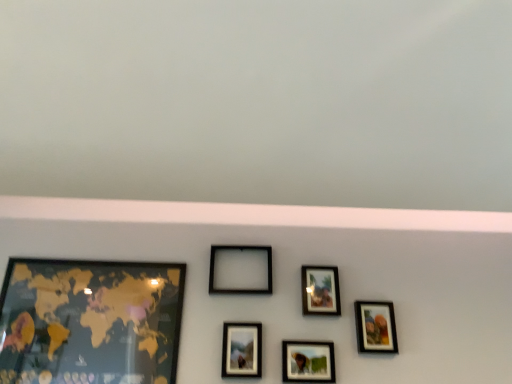
Question: Is gold matte map at left, arranged as the 1th picture frame when viewed from the left, positioned in front of matte black picture frame at upper center, the fifth picture frame viewed from the left?

Choices:
 (A) no
 (B) yes

Answer: (B)

Question: From the image's perspective, would you say gold matte map at left, arranged as the 1th picture frame when viewed from the left, is positioned over matte black picture frame at upper center, the fifth picture frame viewed from the left?

Choices:
 (A) yes
 (B) no

Answer: (B)

Question: Are gold matte map at left, arranged as the 1th picture frame when viewed from the left, and matte black picture frame at upper center, the fifth picture frame viewed from the left, located far from each other?

Choices:
 (A) no
 (B) yes

Answer: (A)

Question: Can you confirm if gold matte map at left, arranged as the 1th picture frame when viewed from the left, is thinner than matte black picture frame at upper center, the 2th picture frame from the right?

Choices:
 (A) no
 (B) yes

Answer: (A)

Question: Does gold matte map at left, which appears as the sixth picture frame when viewed from the right, lie behind matte black picture frame at upper center, the fifth picture frame viewed from the left?

Choices:
 (A) no
 (B) yes

Answer: (A)

Question: Is gold matte map at left, arranged as the 1th picture frame when viewed from the left, smaller than matte black picture frame at upper center, the 2th picture frame from the right?

Choices:
 (A) yes
 (B) no

Answer: (B)

Question: Can matte black picture frame at upper center, the 2th picture frame from the right, be found inside matte black picture frame at center, which appears as the third picture frame when viewed from the right?

Choices:
 (A) yes
 (B) no

Answer: (B)

Question: Is matte black picture frame at center, placed as the fourth picture frame when sorted from left to right, positioned with its back to matte black picture frame at upper center, the fifth picture frame viewed from the left?

Choices:
 (A) yes
 (B) no

Answer: (B)

Question: Is matte black picture frame at center, placed as the fourth picture frame when sorted from left to right, thinner than matte black picture frame at upper center, the fifth picture frame viewed from the left?

Choices:
 (A) yes
 (B) no

Answer: (B)

Question: Is matte black picture frame at center, which appears as the third picture frame when viewed from the right, next to matte black picture frame at upper center, the fifth picture frame viewed from the left?

Choices:
 (A) no
 (B) yes

Answer: (A)

Question: From a real-world perspective, is matte black picture frame at center, which appears as the third picture frame when viewed from the right, physically below matte black picture frame at upper center, the fifth picture frame viewed from the left?

Choices:
 (A) no
 (B) yes

Answer: (B)

Question: Is matte black picture frame at center, which appears as the third picture frame when viewed from the right, to the right of matte black picture frame at upper center, the fifth picture frame viewed from the left, from the viewer's perspective?

Choices:
 (A) yes
 (B) no

Answer: (B)

Question: Can you confirm if matte glass photo frame at center, which appears as the fourth picture frame when viewed from the right, is thinner than matte black picture frame at center, which appears as the third picture frame when viewed from the right?

Choices:
 (A) yes
 (B) no

Answer: (B)